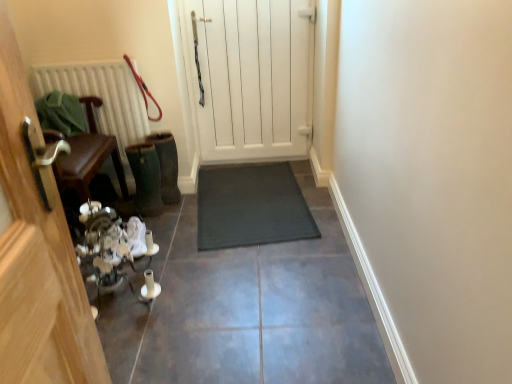
Identify the location of vacant space underneath dark gray rubber mat at center (from a real-world perspective). (265, 200).